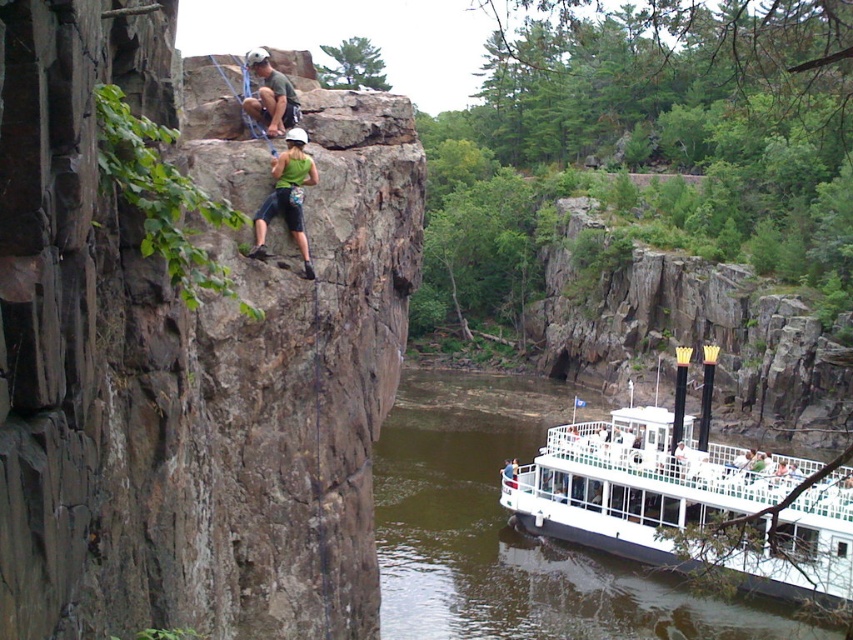
Question: Is rusty stone cliff at upper center thinner than white wooden boat at lower right?

Choices:
 (A) no
 (B) yes

Answer: (B)

Question: Estimate the real-world distances between objects in this image. Which object is closer to the white wooden boat at lower right?

Choices:
 (A) rusty stone cliff at upper center
 (B) green fabric climbing harness at center

Answer: (A)

Question: Which object appears farthest from the camera in this image?

Choices:
 (A) white wooden boat at lower right
 (B) rusty stone cliff at upper center

Answer: (A)

Question: Can you confirm if white wooden boat at lower right is thinner than green fabric climbing harness at center?

Choices:
 (A) no
 (B) yes

Answer: (A)

Question: Which object appears closest to the camera in this image?

Choices:
 (A) white wooden boat at lower right
 (B) green fabric climbing harness at center

Answer: (A)

Question: Is rusty stone cliff at upper center above white wooden boat at lower right?

Choices:
 (A) yes
 (B) no

Answer: (A)